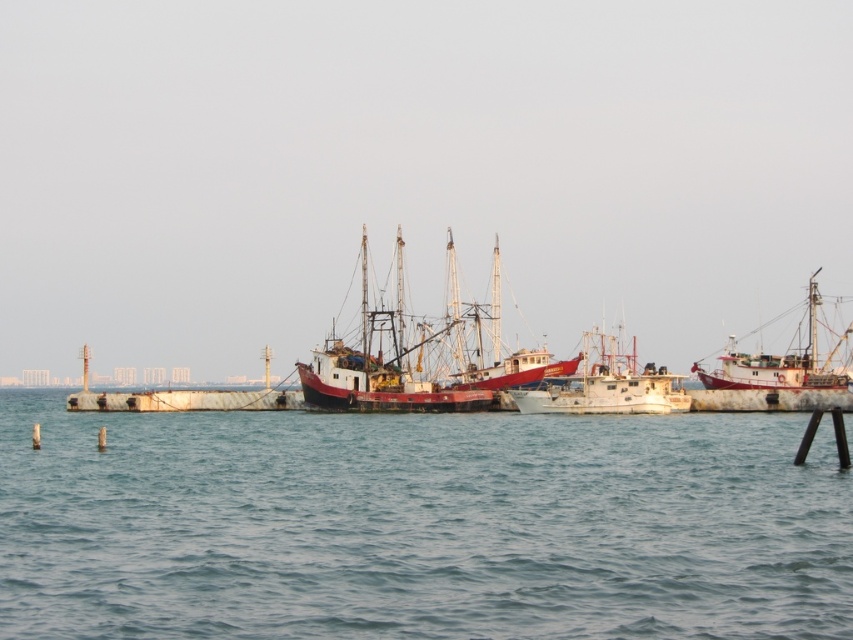
You are standing on the pier and see two boats at the center of the image. Which boat is located to the left when viewed from the pier? The rustic wooden fishing boat at center or the white matte boat at center?

The rustic wooden fishing boat at center is positioned on the left side of the white matte boat at center, so it is located to the left when viewed from the pier.

You are planning to dock your new boat at the pier. You have two options for docking spots next to the rustic wooden fishing boat at center and the white matte boat at center. If you want to choose the spot with more available space, which boat should you dock next to?

The rustic wooden fishing boat at center is wider than the white matte boat at center, so there might be more space available next to the white matte boat at center.